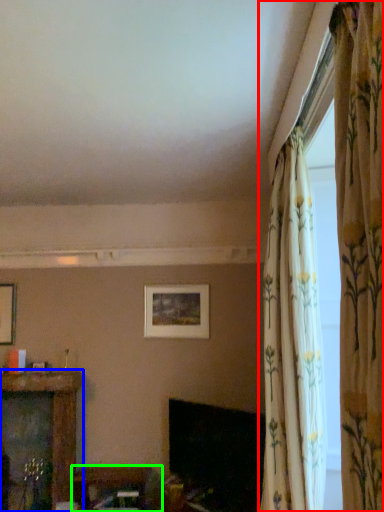
Question: Which object is the closest to the curtain (highlighted by a red box)? Choose among these: furniture (highlighted by a blue box) or furniture (highlighted by a green box).

Choices:
 (A) furniture
 (B) furniture

Answer: (B)